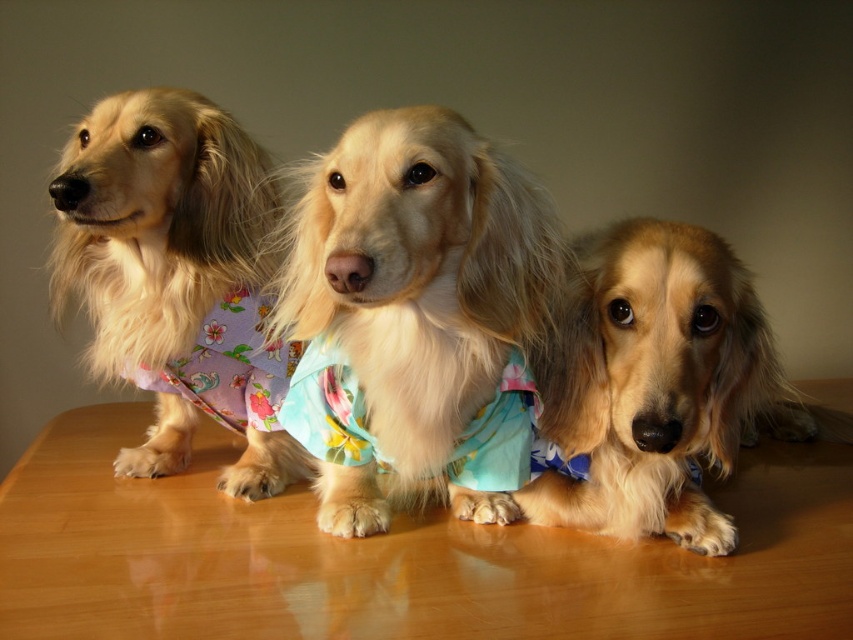
Does wooden table at center appear on the left side of floral fabric dress at center?

Indeed, wooden table at center is positioned on the left side of floral fabric dress at center.

Can you confirm if wooden table at center is thinner than floral fabric dress at center?

Incorrect, wooden table at center's width is not less than floral fabric dress at center's.

Is point (834, 381) behind point (250, 422)?

Yes.

In order to click on wooden table at center in this screenshot , I will do `click(396, 557)`.

Looking at this image, can you confirm if wooden table at center is bigger than fluffy light brown dog at left?

Indeed, wooden table at center has a larger size compared to fluffy light brown dog at left.

Image resolution: width=853 pixels, height=640 pixels. What do you see at coordinates (396, 557) in the screenshot?
I see `wooden table at center` at bounding box center [396, 557].

Where is `wooden table at center`? The image size is (853, 640). wooden table at center is located at coordinates (396, 557).

Can you confirm if fluffy fabric dog at center is positioned below floral fabric dress at center?

No, fluffy fabric dog at center is not below floral fabric dress at center.

Consider the image. Who is shorter, fluffy fabric dog at center or floral fabric dress at center?

floral fabric dress at center

Which is behind, point (430, 122) or point (268, 419)?

Point (268, 419)

Identify the location of fluffy fabric dog at center. The width and height of the screenshot is (853, 640). (415, 320).